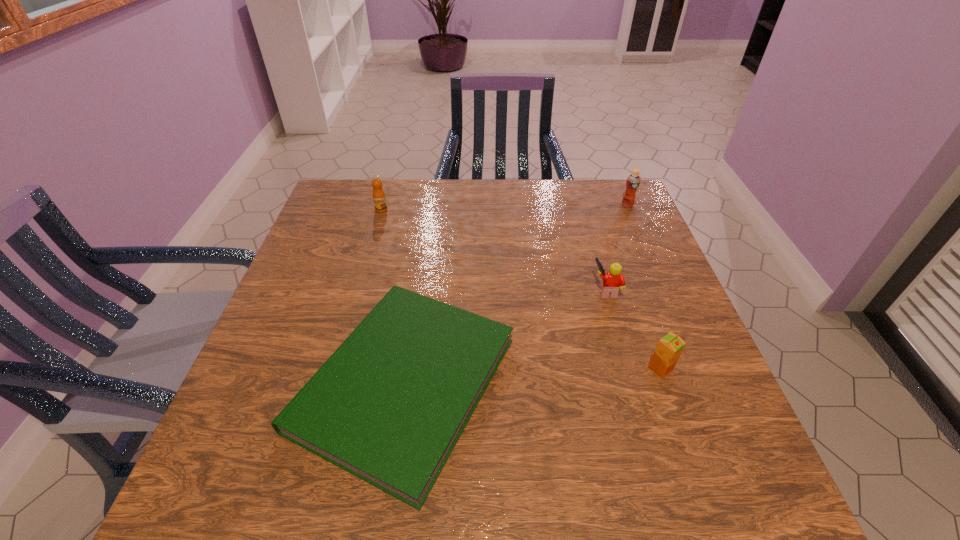
In the image, there is a desktop. Where is `vacant area at the far edge`? vacant area at the far edge is located at coordinates (576, 221).

The width and height of the screenshot is (960, 540). What are the coordinates of `vacant space at the left edge of the desktop` in the screenshot? It's located at (289, 382).

You are a GUI agent. You are given a task and a screenshot of the screen. Output one action in this format:
    pyautogui.click(x=<x>, y=<y>)
    Task: Click on the vacant area at the right edge
    This screenshot has height=540, width=960.
    Given the screenshot: What is the action you would take?
    point(636,266)

This screenshot has width=960, height=540. I want to click on vacant region at the near left corner of the desktop, so click(x=269, y=490).

You are a GUI agent. You are given a task and a screenshot of the screen. Output one action in this format:
    pyautogui.click(x=<x>, y=<y>)
    Task: Click on the free space that is in between the fourth object from left to right and the paperback book
    
    Given the screenshot: What is the action you would take?
    pyautogui.click(x=533, y=376)

At what (x,y) coordinates should I click in order to perform the action: click on unoccupied area between the second orange juice from right to left and the leftmost orange juice. Please return your answer as a coordinate pair (x, y). The image size is (960, 540). Looking at the image, I should click on click(x=521, y=289).

This screenshot has width=960, height=540. In order to click on free space that is in between the third object from right to left and the leftmost orange juice in this screenshot , I will do `click(493, 250)`.

You are a GUI agent. You are given a task and a screenshot of the screen. Output one action in this format:
    pyautogui.click(x=<x>, y=<y>)
    Task: Click on the vacant space in between the rightmost object and the third object from left to right
    This screenshot has width=960, height=540.
    Given the screenshot: What is the action you would take?
    pyautogui.click(x=616, y=247)

Find the location of a particular element. free area in between the leftmost orange juice and the nearest orange juice is located at coordinates (521, 289).

Find the location of a particular element. Image resolution: width=960 pixels, height=540 pixels. vacant area that lies between the third object from left to right and the nearest orange juice is located at coordinates (634, 329).